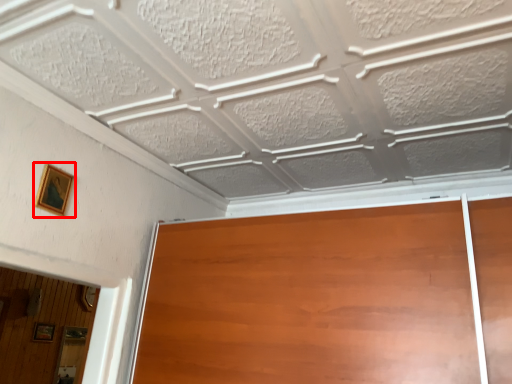
Question: From the image's perspective, what is the correct spatial relationship of picture frame (annotated by the red box) in relation to picture frame?

Choices:
 (A) below
 (B) above

Answer: (B)